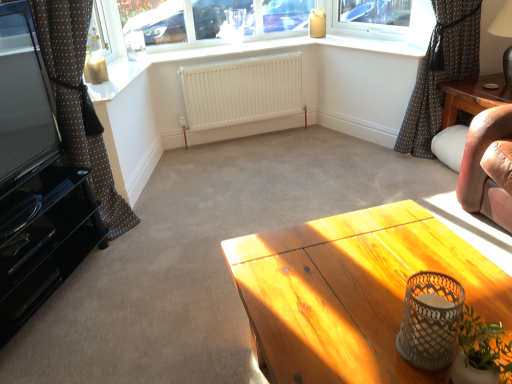
I want to click on free space in front of brown polka dot fabric at left, the first curtain positioned from the left, so click(127, 263).